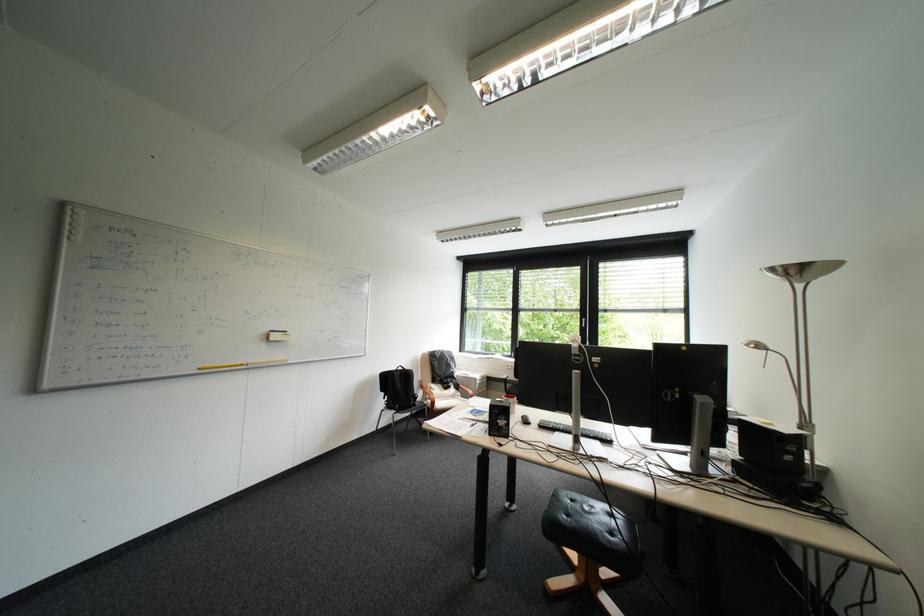
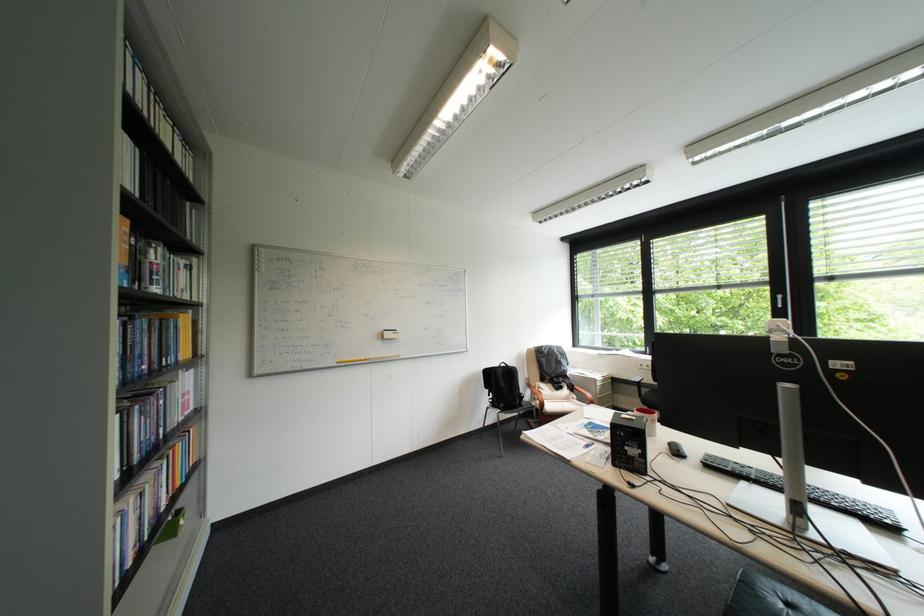
The point at (517, 397) is marked in the first image. Where is the corresponding point in the second image?

(650, 411)